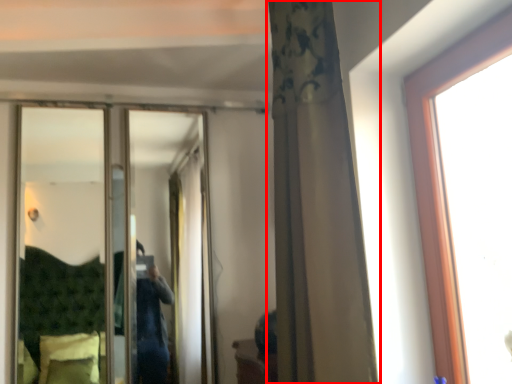
Question: From the image's perspective, what is the correct spatial positioning of curtain (annotated by the red box) in reference to mirror?

Choices:
 (A) above
 (B) below

Answer: (A)